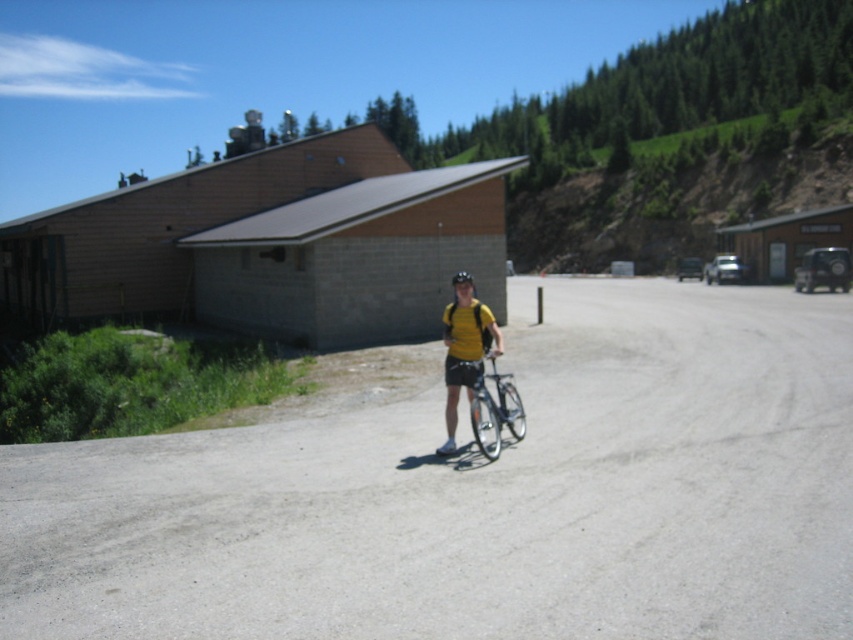
Question: Can you confirm if silver metallic bicycle at center is thinner than black matte bicycle helmet at center?

Choices:
 (A) no
 (B) yes

Answer: (A)

Question: Does yellow matte shirt at center have a smaller size compared to black matte bicycle helmet at center?

Choices:
 (A) no
 (B) yes

Answer: (B)

Question: Is gray asphalt at center further to camera compared to black matte bicycle helmet at center?

Choices:
 (A) no
 (B) yes

Answer: (A)

Question: Which object appears closest to the camera in this image?

Choices:
 (A) gray asphalt at center
 (B) silver metallic bicycle at center

Answer: (A)

Question: Which object is closer to the camera taking this photo?

Choices:
 (A) black matte bicycle helmet at center
 (B) yellow matte shirt at center
 (C) silver metallic bicycle at center
 (D) gray asphalt at center

Answer: (D)

Question: Which point appears farthest from the camera in this image?

Choices:
 (A) (518, 305)
 (B) (465, 276)
 (C) (503, 372)

Answer: (A)